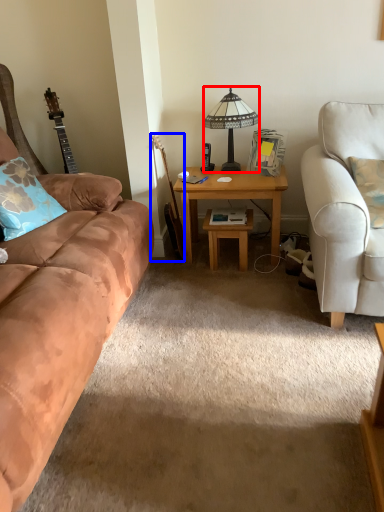
Question: Which of the following is the farthest to the observer, lamp (highlighted by a red box) or guitar (highlighted by a blue box)?

Choices:
 (A) lamp
 (B) guitar

Answer: (B)